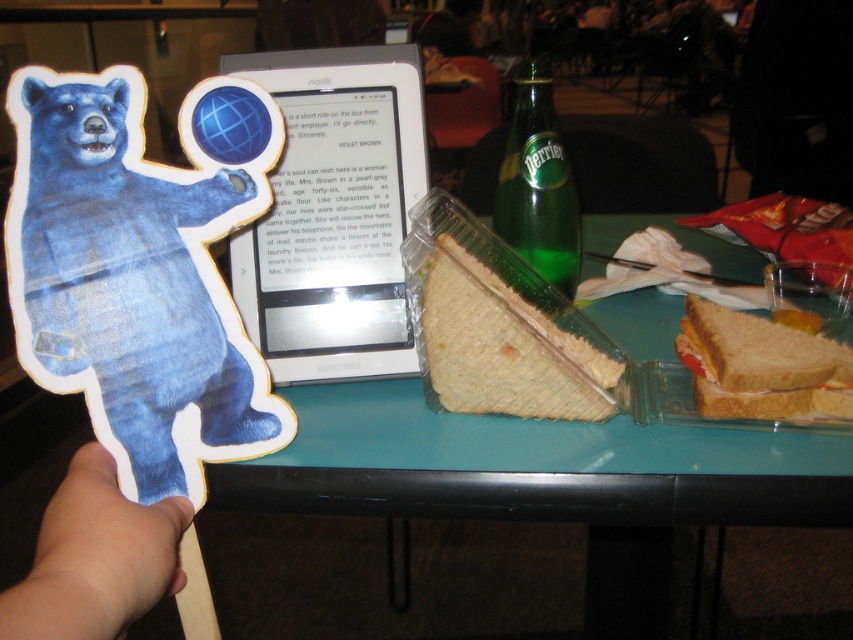
Question: Is golden brown bread at right bigger than green glass bottle at upper center?

Choices:
 (A) yes
 (B) no

Answer: (B)

Question: Based on their relative distances, which object is nearer to the golden brown bread at right?

Choices:
 (A) green glass bottle at upper center
 (B) skinny tan hand at lower left
 (C) blue paper bear at left

Answer: (A)

Question: Which point is closer to the camera?

Choices:
 (A) blue paper bear at left
 (B) green glass bottle at upper center
 (C) golden brown bread at right

Answer: (A)

Question: Can you confirm if skinny tan hand at lower left is positioned below green glass bottle at upper center?

Choices:
 (A) yes
 (B) no

Answer: (A)

Question: Which point is farther to the camera?

Choices:
 (A) green glass bottle at upper center
 (B) blue paper bear at left
 (C) golden brown bread at right
 (D) skinny tan hand at lower left

Answer: (A)

Question: Is skinny tan hand at lower left positioned behind golden brown bread at right?

Choices:
 (A) yes
 (B) no

Answer: (B)